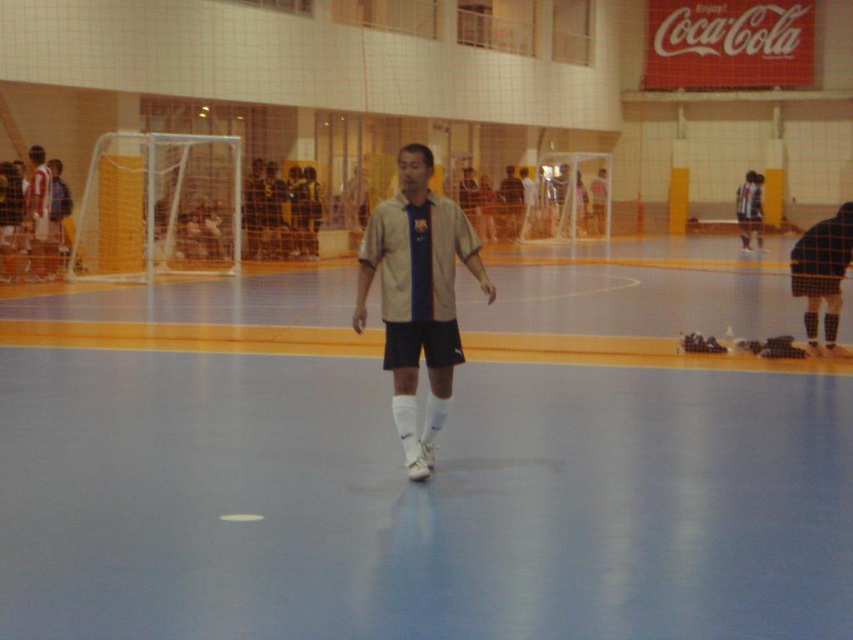
Question: Is dark blue checkered shorts at right above matte white jersey at left?

Choices:
 (A) yes
 (B) no

Answer: (A)

Question: Estimate the real-world distances between objects in this image. Which object is closer to the matte white jersey at left?

Choices:
 (A) dark blue checkered shorts at right
 (B) matte beige shirt at center

Answer: (A)

Question: Among these objects, which one is farthest from the camera?

Choices:
 (A) matte beige shirt at center
 (B) dark blue checkered shorts at right

Answer: (A)

Question: Is beige fabric shirt at center below matte beige shirt at center?

Choices:
 (A) no
 (B) yes

Answer: (B)

Question: Which object is closer to the camera taking this photo?

Choices:
 (A) dark blue checkered shorts at right
 (B) matte beige shirt at center
 (C) beige fabric shirt at center
 (D) matte white jersey at left

Answer: (C)

Question: Is dark blue checkered shorts at right to the left of matte white jersey at left from the viewer's perspective?

Choices:
 (A) no
 (B) yes

Answer: (A)